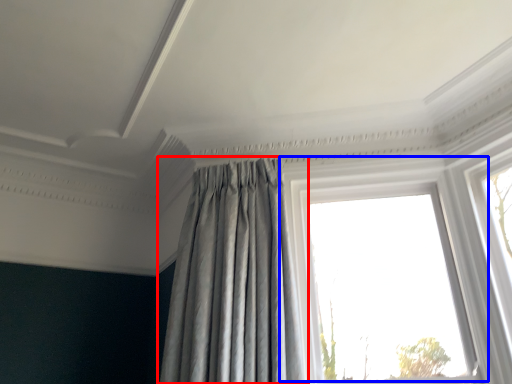
Question: Which object is further to the camera taking this photo, curtain (highlighted by a red box) or window (highlighted by a blue box)?

Choices:
 (A) curtain
 (B) window

Answer: (B)